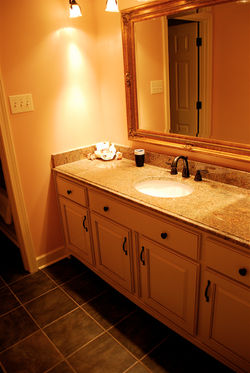
Identify the location of cabinet door. (74, 232), (116, 256), (190, 289), (221, 311).